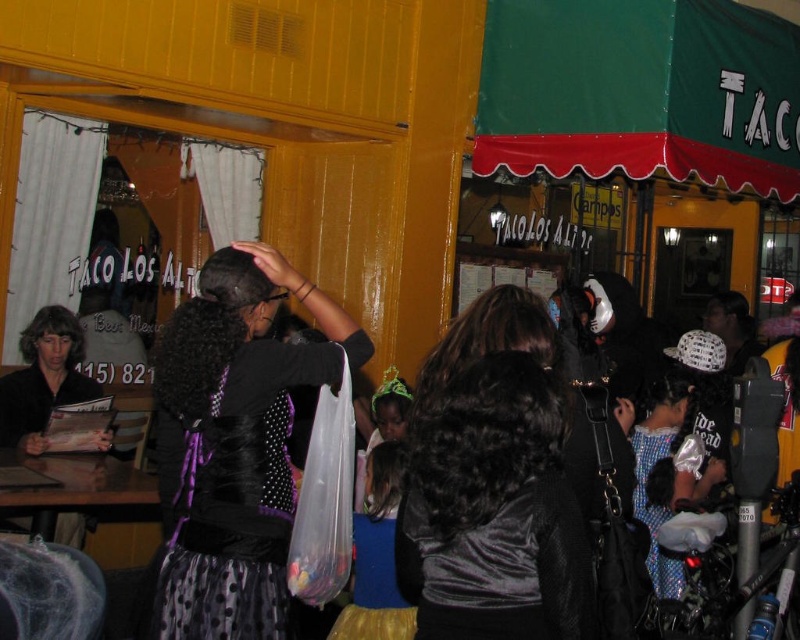
You are a costume designer preparing for a Halloween event. You have two costume items in front of you at the center of the scene, a black satin dress at center and a velvet black shirt at center. Which costume item requires more storage space?

The black satin dress at center is bigger than the velvet black shirt at center, so it requires more storage space.

You are at the restaurant and notice two items hanging on a rack near the entrance. The items are the black satin dress at center and the velvet black shirt at center. Which item is taller?

The black satin dress at center is much taller than the velvet black shirt at center.

You are standing at the entrance of the restaurant and want to reach a point that is 10.05 feet away from you. Can you confirm if the point at coordinates point (230, 264) is exactly that distance away?

Yes, the point at coordinates point (230, 264) is exactly 10.05 feet away from the viewer, so you can reach it by moving directly towards that point.